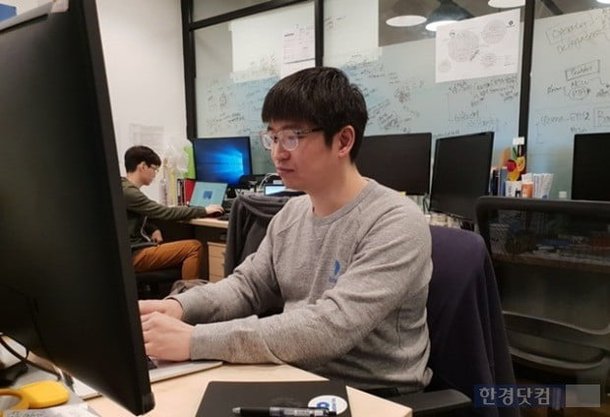
You are a GUI agent. You are given a task and a screenshot of the screen. Output one action in this format:
    pyautogui.click(x=<x>, y=<y>)
    Task: Click on the computer monitor
    The width and height of the screenshot is (610, 417).
    Given the screenshot: What is the action you would take?
    [102, 278], [210, 160], [396, 171], [465, 171], [583, 171]